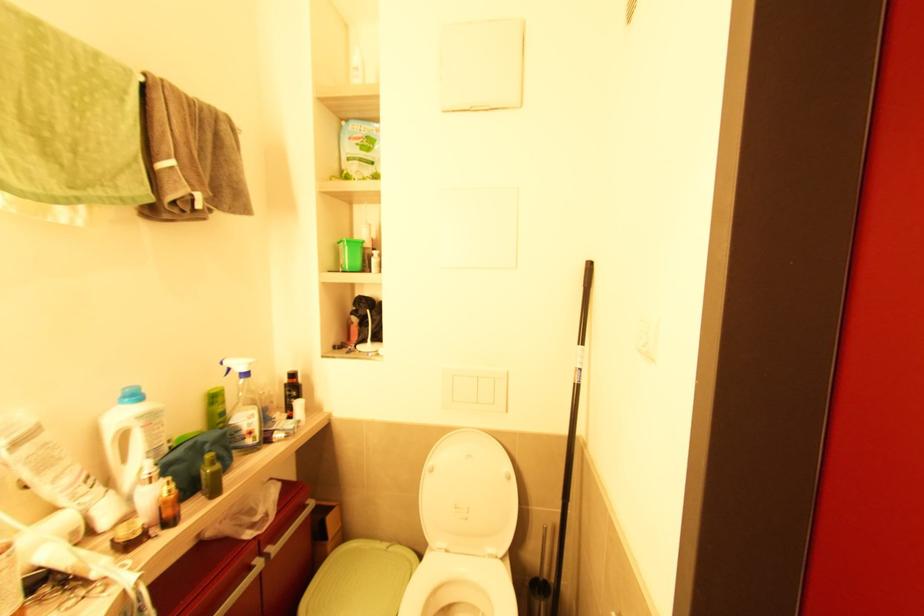
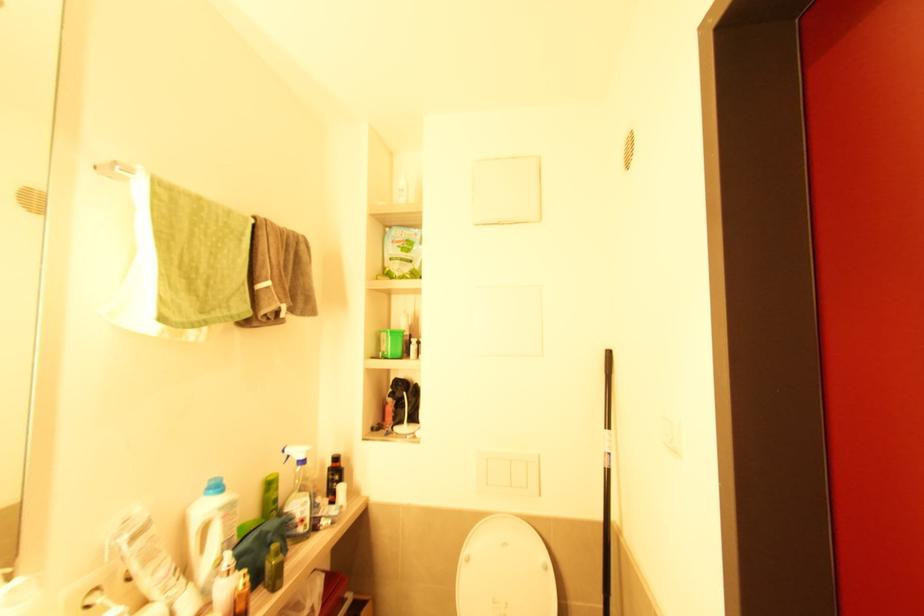
Where in the second image is the point corresponding to the point at 578,387 from the first image?

(610, 472)